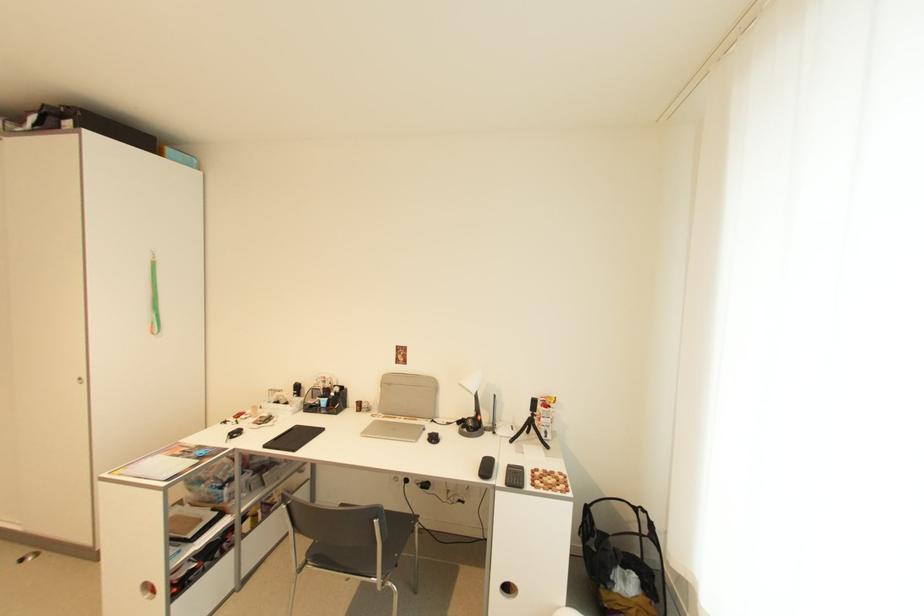
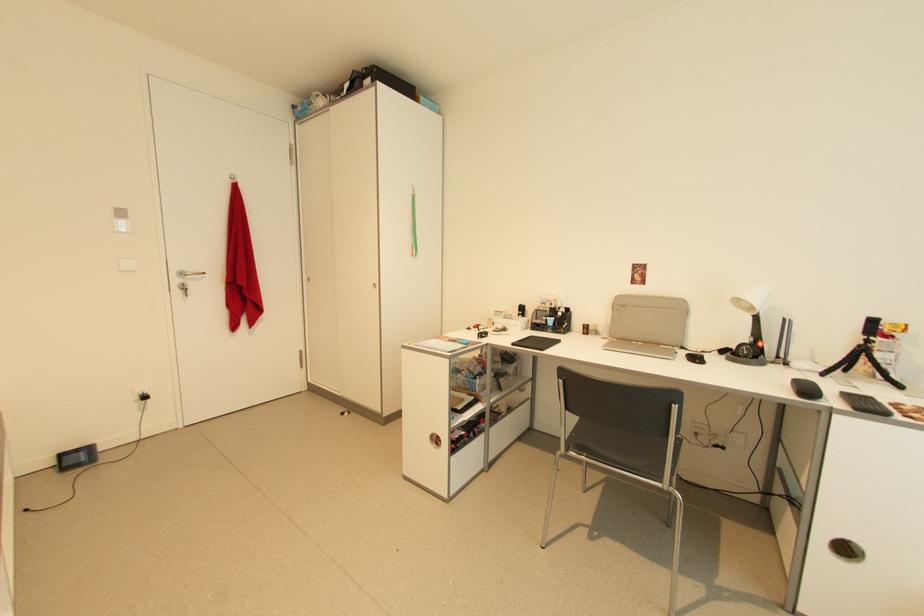
Question: How did the camera likely rotate?

Choices:
 (A) Left
 (B) Right
 (C) Up
 (D) Down

Answer: (A)